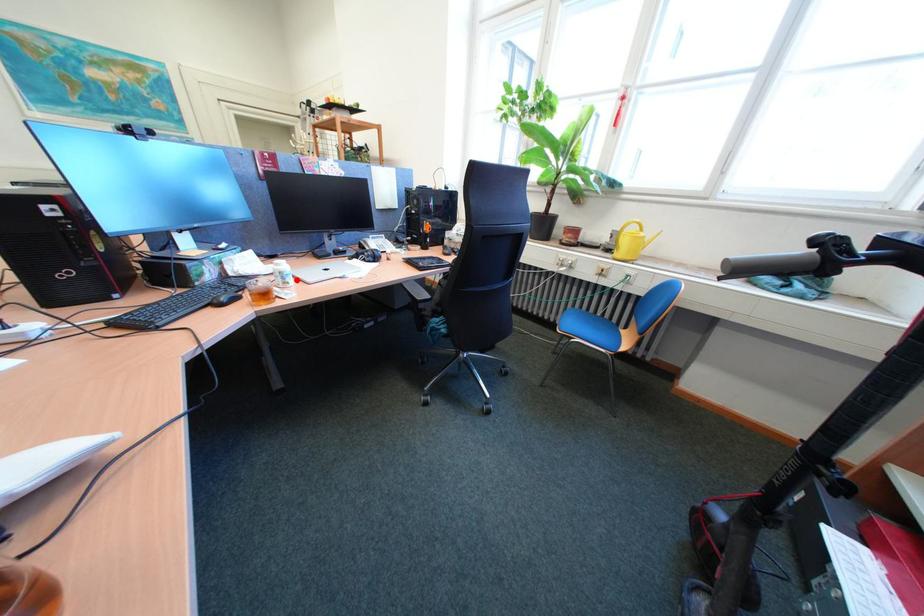
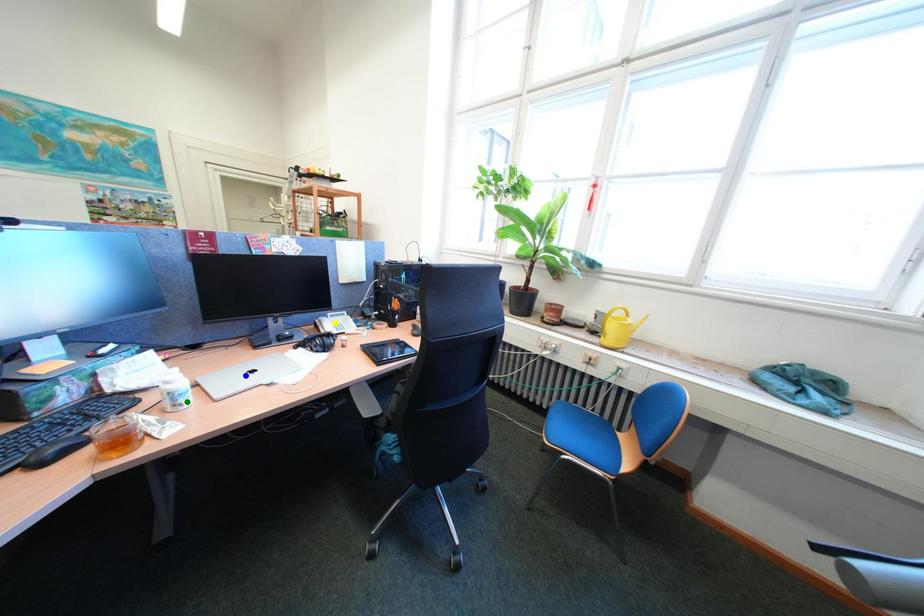
Question: I am providing you with two images of the same scene from different viewpoints. A red point is marked on the first image. You are given multiple points on the second image. Which point in image 2 is actually the same real-world point as the red point in image 1?

Choices:
 (A) yellow point
 (B) blue point
 (C) green point

Answer: (C)